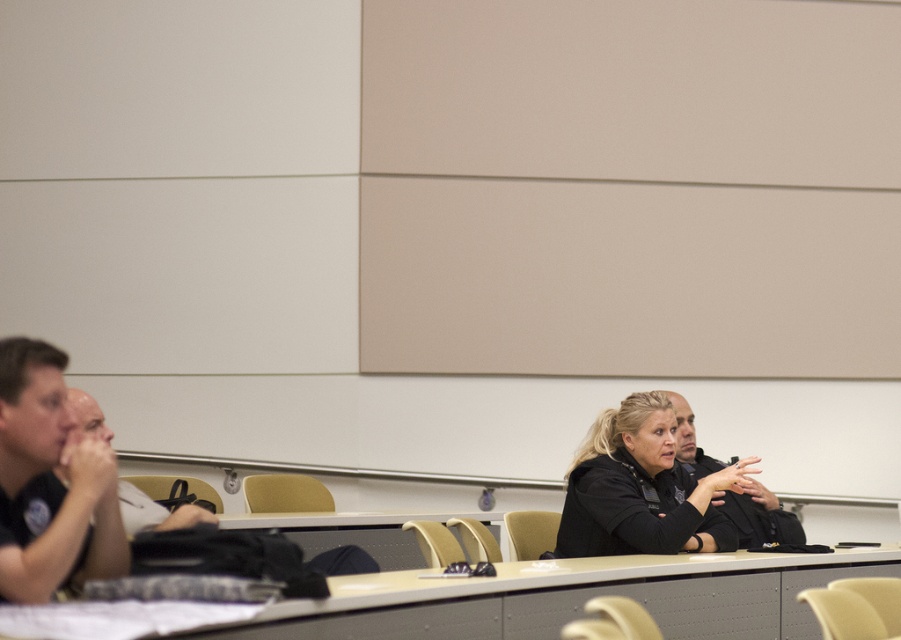
Does smooth beige table at lower center lie behind black matte jacket at center?

No.

Who is shorter, smooth beige table at lower center or black matte jacket at center?

Standing shorter between the two is smooth beige table at lower center.

Describe the element at coordinates (570, 596) in the screenshot. I see `smooth beige table at lower center` at that location.

The height and width of the screenshot is (640, 901). Find the location of `smooth beige table at lower center`. smooth beige table at lower center is located at coordinates (570, 596).

Image resolution: width=901 pixels, height=640 pixels. Describe the element at coordinates (638, 488) in the screenshot. I see `black matte jacket at center` at that location.

Image resolution: width=901 pixels, height=640 pixels. What are the coordinates of `black matte jacket at center` in the screenshot? It's located at (638, 488).

In order to click on black matte jacket at center in this screenshot , I will do `click(638, 488)`.

Who is positioned more to the left, black matte jacket at center or bald head at left?

bald head at left

Who is shorter, black matte jacket at center or bald head at left?

With less height is bald head at left.

In order to click on black matte jacket at center in this screenshot , I will do `click(638, 488)`.

Where is `black matte jacket at center`? black matte jacket at center is located at coordinates (638, 488).